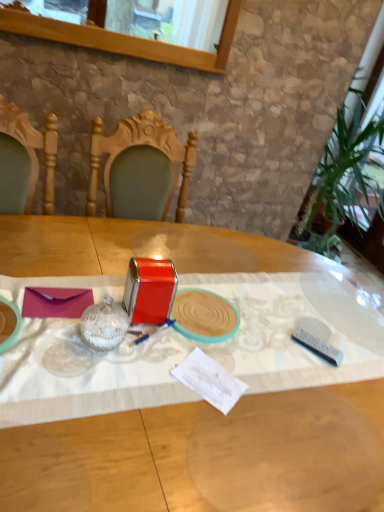
From the picture: Measure the distance between purple matte envelope at center and camera.

37.85 inches.

Based on the photo, measure the distance between point (77,432) and camera.

A distance of 75.30 centimeters exists between point (77,432) and camera.

The height and width of the screenshot is (512, 384). What do you see at coordinates (124, 39) in the screenshot?
I see `clear glass window at upper center` at bounding box center [124, 39].

At what (x,y) coordinates should I click in order to perform the action: click on purple matte envelope at center. Please return your answer as a coordinate pair (x, y). The width and height of the screenshot is (384, 512). Looking at the image, I should click on (56, 302).

Looking at this image, between purple matte envelope at center and white plastic remote at lower right, acting as the 4th tableware starting from the left, which one has larger size?

With larger size is purple matte envelope at center.

From a real-world perspective, which object stands above the other?

white plastic remote at lower right, the first tableware when ordered from right to left.

In the scene shown: Is purple matte envelope at center looking in the opposite direction of white plastic remote at lower right, acting as the 4th tableware starting from the left?

Yes, purple matte envelope at center is facing away from white plastic remote at lower right, acting as the 4th tableware starting from the left.

Considering the positions of objects white plastic remote at lower right, the first tableware when ordered from right to left, and metallic red tin at center, the third tableware from the right, in the image provided, who is more to the right, white plastic remote at lower right, the first tableware when ordered from right to left, or metallic red tin at center, the third tableware from the right,?

Positioned to the right is white plastic remote at lower right, the first tableware when ordered from right to left.

Who is smaller, white plastic remote at lower right, the first tableware when ordered from right to left, or metallic red tin at center, the third tableware from the right?

white plastic remote at lower right, the first tableware when ordered from right to left.

Is white plastic remote at lower right, the first tableware when ordered from right to left, oriented away from metallic red tin at center, the third tableware from the right?

No, white plastic remote at lower right, the first tableware when ordered from right to left, is not facing the opposite direction of metallic red tin at center, the third tableware from the right.

Which object is further away from the camera, metallic red tin at center or purple matte envelope at center?

purple matte envelope at center.

Looking at this image, would you say purple matte envelope at center is part of metallic red tin at center's contents?

Indeed, purple matte envelope at center is located within metallic red tin at center.

From the image's perspective, is metallic red tin at center located above or below purple matte envelope at center?

metallic red tin at center is situated lower than purple matte envelope at center in the image.

Based on the photo, is metallic red tin at center, the third tableware from the right, bigger than white plastic remote at lower right, acting as the 4th tableware starting from the left?

Correct, metallic red tin at center, the third tableware from the right, is larger in size than white plastic remote at lower right, acting as the 4th tableware starting from the left.

Image resolution: width=384 pixels, height=512 pixels. I want to click on the 2nd tableware below the metallic red tin at center, positioned as the second tableware in left-to-right order (from a real-world perspective), so click(318, 346).

Does metallic red tin at center, the third tableware from the right, come in front of white plastic remote at lower right, the first tableware when ordered from right to left?

Yes, metallic red tin at center, the third tableware from the right, is closer to the camera.

From a real-world perspective, is metallic red tin at center, the third tableware from the right, physically located above or below white plastic remote at lower right, the first tableware when ordered from right to left?

In terms of real-world spatial position, metallic red tin at center, the third tableware from the right, is above white plastic remote at lower right, the first tableware when ordered from right to left.

Is metallic red tin at center, marked as the 2th tableware in a right-to-left arrangement, placed right next to metallic red tin at center?

There is a gap between metallic red tin at center, marked as the 2th tableware in a right-to-left arrangement, and metallic red tin at center.

From the image's perspective, is metallic red tin at center, marked as the 2th tableware in a right-to-left arrangement, on metallic red tin at center?

Yes.

Is metallic red tin at center, marked as the 2th tableware in a right-to-left arrangement, shorter than metallic red tin at center?

Yes, metallic red tin at center, marked as the 2th tableware in a right-to-left arrangement, is shorter than metallic red tin at center.

Is metallic red tin at center, marked as the 2th tableware in a right-to-left arrangement, to the left of metallic red tin at center from the viewer's perspective?

Yes.

From a real-world perspective, count 2nd tablewares upward from the metallic red tin at center, marked as the third tableware in a left-to-right arrangement, and point to it. Please provide its 2D coordinates.

[(104, 324)]

From the picture: Does clear glass jar at center, acting as the 1th tableware starting from the left, have a greater height compared to metallic red tin at center, marked as the 2th tableware in a right-to-left arrangement?

Indeed, clear glass jar at center, acting as the 1th tableware starting from the left, has a greater height compared to metallic red tin at center, marked as the 2th tableware in a right-to-left arrangement.

Could you tell me if clear glass jar at center, acting as the 4th tableware starting from the right, is turned towards metallic red tin at center, marked as the third tableware in a left-to-right arrangement?

No, clear glass jar at center, acting as the 4th tableware starting from the right, is not turned towards metallic red tin at center, marked as the third tableware in a left-to-right arrangement.

Would you consider metallic red tin at center, marked as the third tableware in a left-to-right arrangement, to be distant from clear glass window at upper center?

Yes, metallic red tin at center, marked as the third tableware in a left-to-right arrangement, and clear glass window at upper center are quite far apart.

From the image's perspective, which one is positioned lower, metallic red tin at center, marked as the 2th tableware in a right-to-left arrangement, or clear glass window at upper center?

metallic red tin at center, marked as the 2th tableware in a right-to-left arrangement, appears lower in the image.

Based on the photo, can you confirm if metallic red tin at center, marked as the 2th tableware in a right-to-left arrangement, is bigger than clear glass window at upper center?

No.

Where is `notepad that is under the white plastic remote at lower right, acting as the 4th tableware starting from the left (from a real-world perspective)`? This screenshot has height=512, width=384. notepad that is under the white plastic remote at lower right, acting as the 4th tableware starting from the left (from a real-world perspective) is located at coordinates (56, 302).

In order to click on the 3rd tableware positioned below the metallic red tin at center, the third tableware from the right (from the image's perspective) in this screenshot , I will do `click(318, 346)`.

From the image, which object appears to be farther from clear glass window at upper center, purple matte envelope at center or metallic red tin at center, the third tableware from the right?

Based on the image, purple matte envelope at center appears to be further to clear glass window at upper center.

Considering their positions, is white plastic remote at lower right, acting as the 4th tableware starting from the left, positioned closer to purple matte envelope at center than metallic red tin at center, positioned as the second tableware in left-to-right order?

Based on the image, metallic red tin at center, positioned as the second tableware in left-to-right order, appears to be nearer to purple matte envelope at center.

Estimate the real-world distances between objects in this image. Which object is closer to white plastic remote at lower right, acting as the 4th tableware starting from the left, clear glass jar at center, acting as the 4th tableware starting from the right, or clear glass window at upper center?

The object closer to white plastic remote at lower right, acting as the 4th tableware starting from the left, is clear glass jar at center, acting as the 4th tableware starting from the right.

When comparing their distances from white plastic remote at lower right, the first tableware when ordered from right to left, does clear glass window at upper center or clear glass jar at center, acting as the 1th tableware starting from the left, seem closer?

clear glass jar at center, acting as the 1th tableware starting from the left, lies closer to white plastic remote at lower right, the first tableware when ordered from right to left, than the other object.

Which object lies nearer to the anchor point white plastic remote at lower right, the first tableware when ordered from right to left, metallic red tin at center, the third tableware from the right, or purple matte envelope at center?

metallic red tin at center, the third tableware from the right, lies closer to white plastic remote at lower right, the first tableware when ordered from right to left, than the other object.

Based on the photo, looking at the image, which one is located closer to metallic red tin at center, white plastic remote at lower right, the first tableware when ordered from right to left, or metallic red tin at center, marked as the 2th tableware in a right-to-left arrangement?

The object closer to metallic red tin at center is metallic red tin at center, marked as the 2th tableware in a right-to-left arrangement.

Which object lies further to the anchor point metallic red tin at center, marked as the 2th tableware in a right-to-left arrangement, purple matte envelope at center or white plastic remote at lower right, acting as the 4th tableware starting from the left?

purple matte envelope at center.

From the picture: From the image, which object appears to be farther from clear glass window at upper center, metallic red tin at center, positioned as the second tableware in left-to-right order, or purple matte envelope at center?

Based on the image, purple matte envelope at center appears to be further to clear glass window at upper center.

Where is `notepad between clear glass window at upper center and metallic red tin at center in the vertical direction`? Image resolution: width=384 pixels, height=512 pixels. notepad between clear glass window at upper center and metallic red tin at center in the vertical direction is located at coordinates (56, 302).

At what (x,y) coordinates should I click in order to perform the action: click on tableware between clear glass jar at center, acting as the 4th tableware starting from the right, and metallic red tin at center, marked as the 2th tableware in a right-to-left arrangement, in the horizontal direction. Please return your answer as a coordinate pair (x, y). Looking at the image, I should click on (149, 290).

Find the location of `notepad between clear glass window at upper center and clear glass jar at center, acting as the 4th tableware starting from the right, in the vertical direction`. notepad between clear glass window at upper center and clear glass jar at center, acting as the 4th tableware starting from the right, in the vertical direction is located at coordinates (56, 302).

Identify the location of notepad between metallic red tin at center and metallic red tin at center, marked as the 2th tableware in a right-to-left arrangement, in the front-back direction. (56, 302).